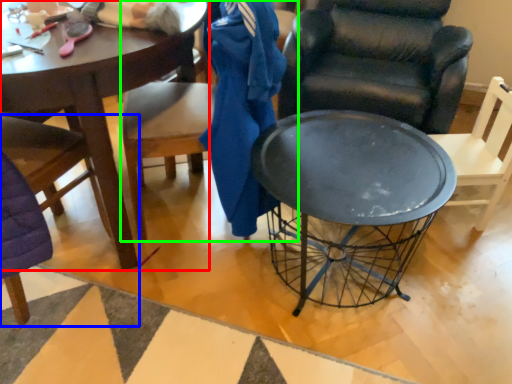
Question: Which object is positioned closest to coffee table (highlighted by a red box)? Select from chair (highlighted by a blue box) and chair (highlighted by a green box).

Choices:
 (A) chair
 (B) chair

Answer: (B)